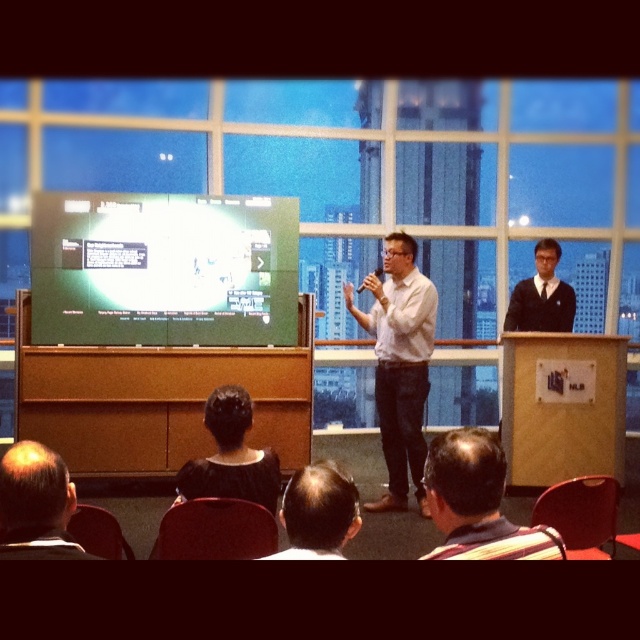
Question: Which object is the closest to the bald head at lower left?

Choices:
 (A) dark brown hair at lower center
 (B) black sweater at center

Answer: (A)

Question: Is green matte projection screen at center closer to camera compared to black sweater at center?

Choices:
 (A) yes
 (B) no

Answer: (A)

Question: Which object is positioned farthest from the white shirt at center?

Choices:
 (A) green matte projection screen at center
 (B) bald head at lower left

Answer: (B)

Question: Does dark brown leather jacket at lower right appear under bald head at lower left?

Choices:
 (A) no
 (B) yes

Answer: (A)

Question: Which of the following is the farthest from the observer?

Choices:
 (A) [x=61, y=298]
 (B) [x=512, y=292]
 (C) [x=356, y=504]

Answer: (B)

Question: Is white shirt at center above dark brown hair at lower center?

Choices:
 (A) no
 (B) yes

Answer: (B)